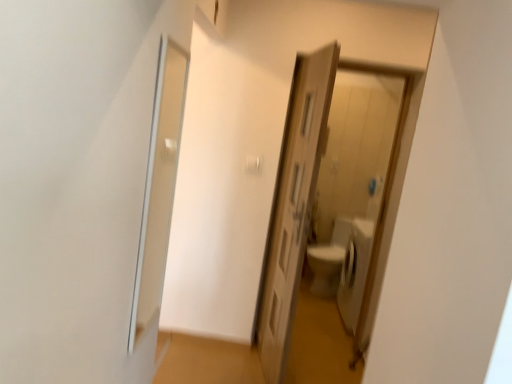
Locate an element on the screen. vacant area on top of brown wooden door at center, the first path when ordered from front to back (from a real-world perspective) is located at coordinates (241, 364).